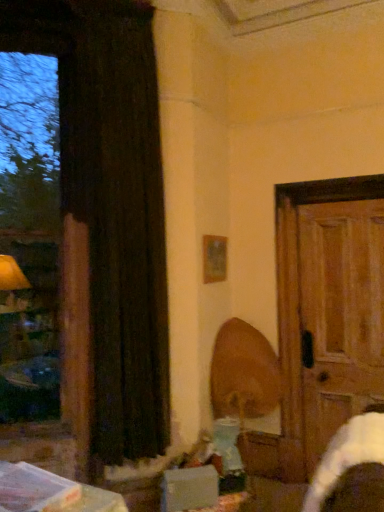
The height and width of the screenshot is (512, 384). What do you see at coordinates (244, 378) in the screenshot? I see `wooden swivel chair at center` at bounding box center [244, 378].

This screenshot has width=384, height=512. In order to click on black velvet curtain at left in this screenshot , I will do click(x=113, y=234).

The width and height of the screenshot is (384, 512). What do you see at coordinates (189, 489) in the screenshot? I see `white cardboard box at lower center` at bounding box center [189, 489].

This screenshot has height=512, width=384. Describe the element at coordinates (214, 259) in the screenshot. I see `wooden picture frame at upper center` at that location.

In order to click on wooden picture frame at upper center in this screenshot , I will do `click(214, 259)`.

I want to click on wooden swivel chair at center, so click(244, 378).

From the image's perspective, relative to white cardboard box at lower center, is wooden picture frame at upper center above or below?

wooden picture frame at upper center is above white cardboard box at lower center.

Is wooden picture frame at upper center positioned in front of white cardboard box at lower center?

No.

You are a GUI agent. You are given a task and a screenshot of the screen. Output one action in this format:
    pyautogui.click(x=<x>, y=<y>)
    Task: Click on the cardboard box in front of the wooden picture frame at upper center
    
    Given the screenshot: What is the action you would take?
    pyautogui.click(x=189, y=489)

Which object is thinner, wooden picture frame at upper center or white cardboard box at lower center?

Thinner between the two is wooden picture frame at upper center.

Is white cardboard box at lower center outside of black velvet curtain at left?

Yes, white cardboard box at lower center is not within black velvet curtain at left.

Considering the sizes of objects white cardboard box at lower center and black velvet curtain at left in the image provided, who is bigger, white cardboard box at lower center or black velvet curtain at left?

black velvet curtain at left is bigger.

Does white cardboard box at lower center lie behind black velvet curtain at left?

No, white cardboard box at lower center is closer to the camera.

Is white cardboard box at lower center facing away from black velvet curtain at left?

white cardboard box at lower center does not have its back to black velvet curtain at left.

Can you confirm if wooden swivel chair at center is shorter than white cardboard box at lower center?

Incorrect, the height of wooden swivel chair at center does not fall short of that of white cardboard box at lower center.

From the picture: Which is correct: wooden swivel chair at center is inside white cardboard box at lower center, or outside of it?

wooden swivel chair at center cannot be found inside white cardboard box at lower center.

From the picture: Would you say wooden swivel chair at center is a long distance from white cardboard box at lower center?

They are positioned close to each other.

Is black velvet curtain at left not inside wooden picture frame at upper center?

Absolutely, black velvet curtain at left is external to wooden picture frame at upper center.

Can you confirm if black velvet curtain at left is wider than wooden picture frame at upper center?

Yes.

Identify the location of picture frame below the black velvet curtain at left (from the image's perspective). (214, 259).

Would you say black velvet curtain at left is a long distance from wooden picture frame at upper center?

No, there isn't a large distance between black velvet curtain at left and wooden picture frame at upper center.

Looking at this image, is wooden swivel chair at center looking in the opposite direction of wooden picture frame at upper center?

wooden swivel chair at center is not turned away from wooden picture frame at upper center.

From the image's perspective, is wooden swivel chair at center located above wooden picture frame at upper center?

Incorrect, from the image's perspective, wooden swivel chair at center is lower than wooden picture frame at upper center.

Is wooden swivel chair at center far from wooden picture frame at upper center?

That's not correct — wooden swivel chair at center is a little close to wooden picture frame at upper center.

Could you tell me if wooden door at right is turned towards white cardboard box at lower center?

No, wooden door at right is not oriented towards white cardboard box at lower center.

Is wooden door at right touching white cardboard box at lower center?

No, wooden door at right is not making contact with white cardboard box at lower center.

The image size is (384, 512). What are the coordinates of `door above the white cardboard box at lower center (from a real-world perspective)` in the screenshot? It's located at (327, 312).

Considering the points (380, 340) and (173, 490), which point is in front, point (380, 340) or point (173, 490)?

The point (173, 490) is more forward.

Does black velvet curtain at left lie behind wooden door at right?

No, black velvet curtain at left is in front of wooden door at right.

This screenshot has width=384, height=512. Find the location of `door below the black velvet curtain at left (from the image's perspective)`. door below the black velvet curtain at left (from the image's perspective) is located at coordinates (327, 312).

Is black velvet curtain at left facing towards wooden door at right?

No, black velvet curtain at left is not facing towards wooden door at right.

Would you say black velvet curtain at left is outside wooden door at right?

black velvet curtain at left is positioned outside wooden door at right.

Locate an element on the screen. This screenshot has height=512, width=384. cardboard box located on the left of wooden picture frame at upper center is located at coordinates (189, 489).

I want to click on curtain above the white cardboard box at lower center (from a real-world perspective), so click(x=113, y=234).

Consider the image. From the image, which object appears to be nearer to white cardboard box at lower center, wooden door at right or wooden swivel chair at center?

The object closer to white cardboard box at lower center is wooden swivel chair at center.

When comparing their distances from black velvet curtain at left, does wooden door at right or wooden swivel chair at center seem further?

wooden door at right.

Looking at the image, which one is located closer to wooden door at right, white cardboard box at lower center or black velvet curtain at left?

Based on the image, white cardboard box at lower center appears to be nearer to wooden door at right.

Which object lies further to the anchor point wooden door at right, black velvet curtain at left or white cardboard box at lower center?

black velvet curtain at left lies further to wooden door at right than the other object.

From the image, which object appears to be nearer to wooden door at right, white cardboard box at lower center or wooden picture frame at upper center?

The object closer to wooden door at right is wooden picture frame at upper center.

Based on their spatial positions, is wooden door at right or white cardboard box at lower center further from wooden swivel chair at center?

white cardboard box at lower center is further to wooden swivel chair at center.

Considering their positions, is wooden picture frame at upper center positioned closer to wooden door at right than wooden swivel chair at center?

wooden swivel chair at center is positioned closer to the anchor wooden door at right.

Estimate the real-world distances between objects in this image. Which object is further from wooden swivel chair at center, wooden door at right or black velvet curtain at left?

black velvet curtain at left.

Identify the location of swivel chair between wooden picture frame at upper center and white cardboard box at lower center vertically. (244, 378).

Where is `door between wooden picture frame at upper center and white cardboard box at lower center in the up-down direction`? The height and width of the screenshot is (512, 384). door between wooden picture frame at upper center and white cardboard box at lower center in the up-down direction is located at coordinates (327, 312).

Where is `door between wooden picture frame at upper center and wooden swivel chair at center in the up-down direction`? door between wooden picture frame at upper center and wooden swivel chair at center in the up-down direction is located at coordinates (327, 312).

You are a GUI agent. You are given a task and a screenshot of the screen. Output one action in this format:
    pyautogui.click(x=<x>, y=<y>)
    Task: Click on the picture frame that lies between black velvet curtain at left and wooden swivel chair at center from top to bottom
    The height and width of the screenshot is (512, 384).
    Given the screenshot: What is the action you would take?
    pyautogui.click(x=214, y=259)